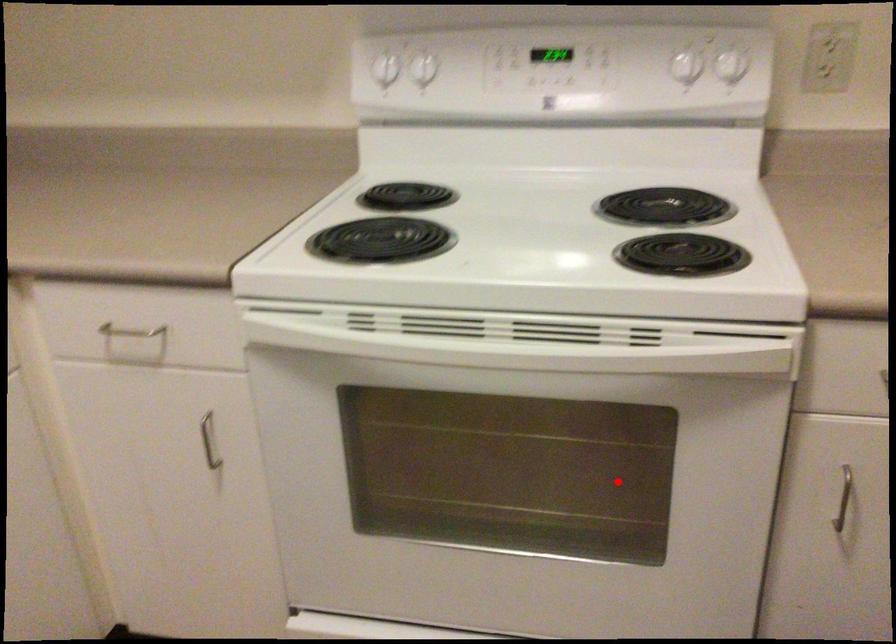
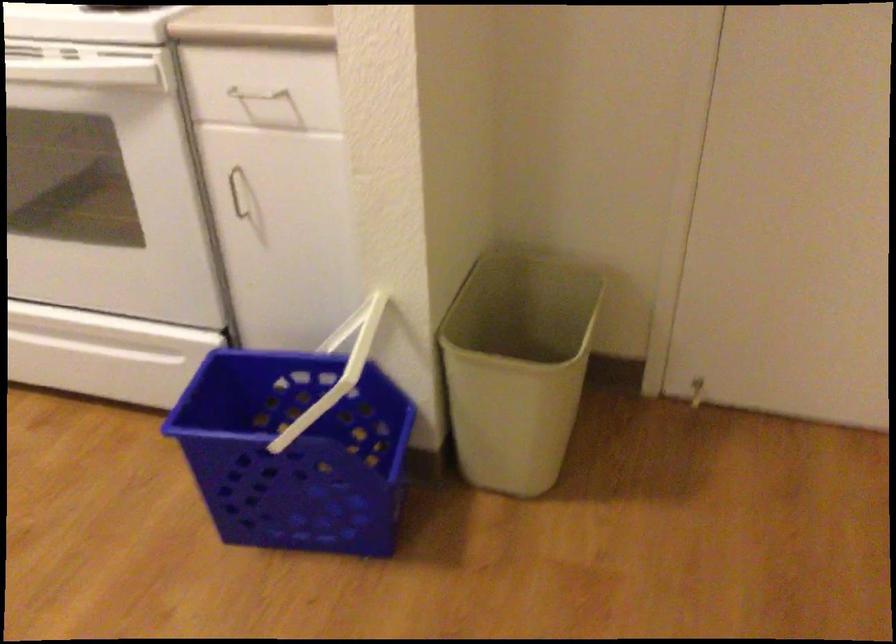
Question: A red point is marked in image1. In image2, is the corresponding 3D point closer to the camera or farther? Reply with the corresponding letter.

Choices:
 (A) The corresponding 3D point is closer.
 (B) The corresponding 3D point is farther.

Answer: (B)